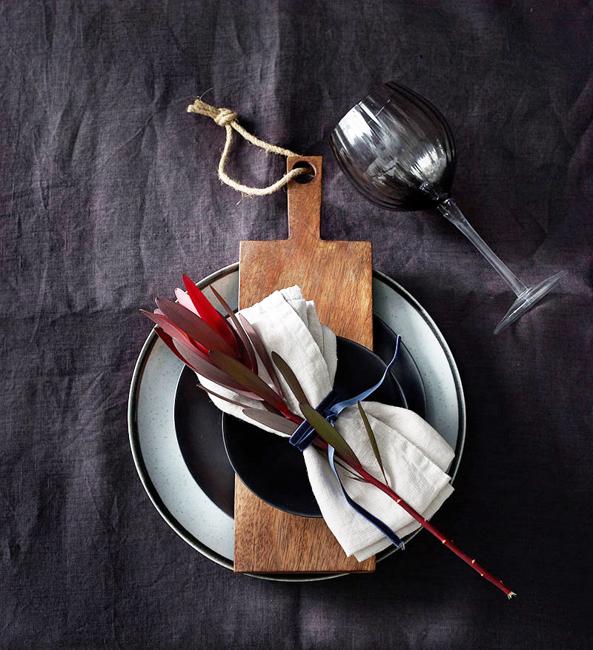
The image size is (593, 650). Identify the location of cutting board. (276, 558).